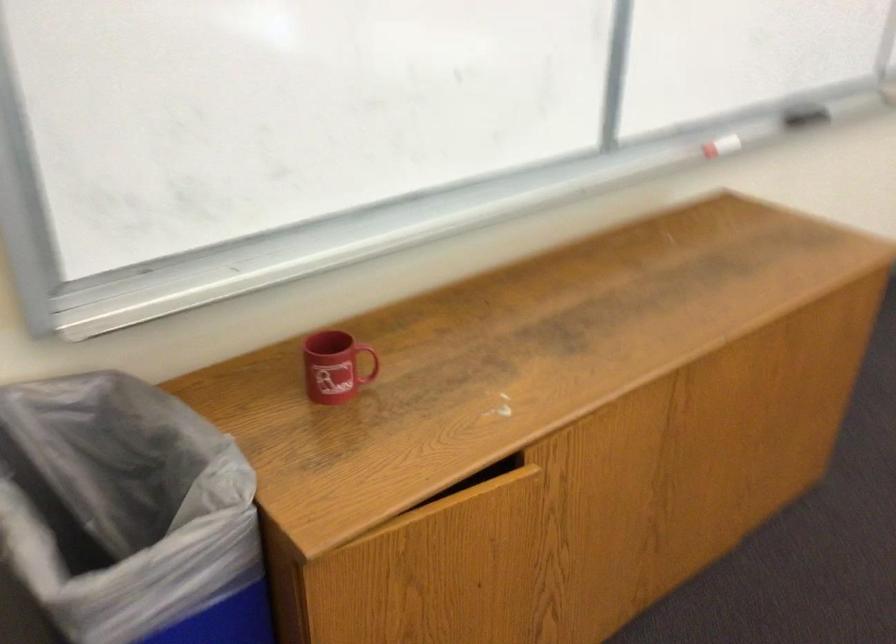
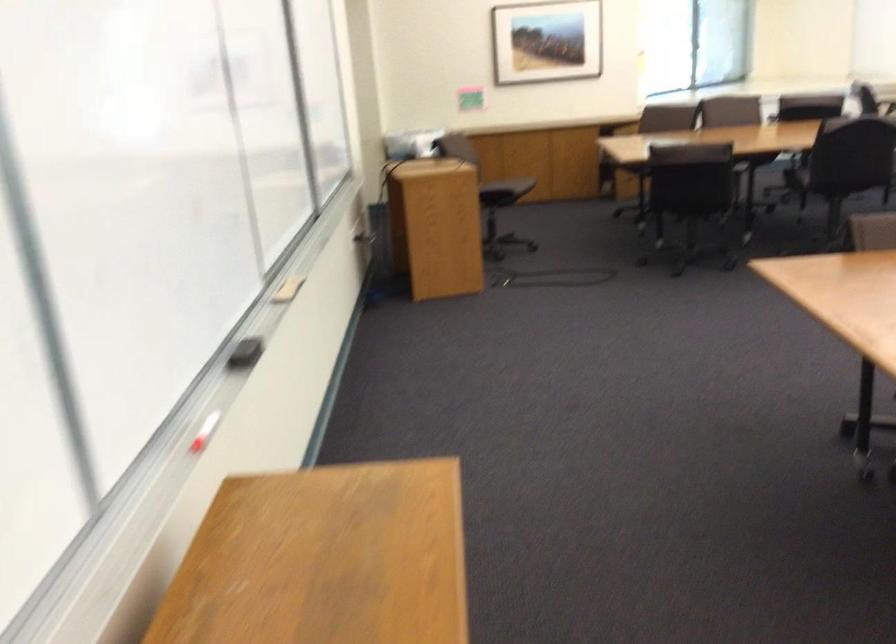
The point at (812, 109) is marked in the first image. Where is the corresponding point in the second image?

(246, 353)